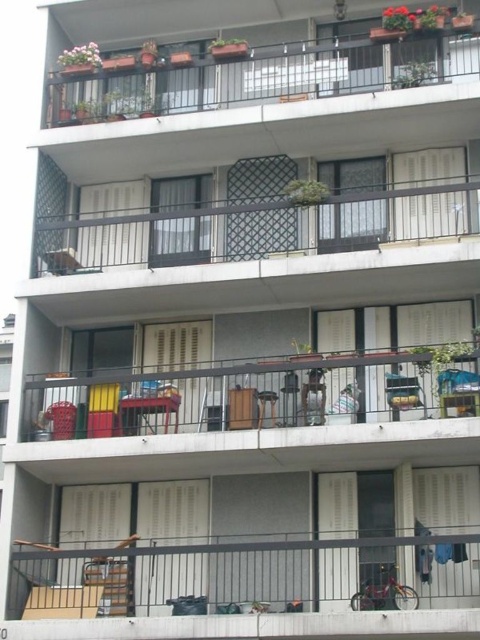
Is metallic gray railing at lower center positioned before metallic gray furniture at lower left?

Yes, metallic gray railing at lower center is in front of metallic gray furniture at lower left.

Consider the image. Which of these two, metallic gray railing at lower center or metallic gray furniture at lower left, stands shorter?

metallic gray railing at lower center is shorter.

Find the location of a particular element. This screenshot has height=640, width=480. metallic gray railing at lower center is located at coordinates (263, 568).

Where is `metallic gray railing at lower center`? metallic gray railing at lower center is located at coordinates (263, 568).

Which of these two, metallic gray railing at lower center or metallic silver chair at center, stands shorter?

With less height is metallic silver chair at center.

Can you confirm if metallic gray railing at lower center is smaller than metallic silver chair at center?

No.

Find the location of a particular element. Image resolution: width=480 pixels, height=640 pixels. metallic gray railing at lower center is located at coordinates (263, 568).

This screenshot has width=480, height=640. What are the coordinates of `metallic gray railing at lower center` in the screenshot? It's located at (263, 568).

The width and height of the screenshot is (480, 640). Describe the element at coordinates (228, 451) in the screenshot. I see `metallic gray furniture at lower left` at that location.

Between point (276, 442) and point (396, 381), which one is positioned in front?

Positioned in front is point (276, 442).

Is point (235, 369) closer to viewer compared to point (396, 376)?

No, it is not.

The width and height of the screenshot is (480, 640). What are the coordinates of `metallic gray furniture at lower left` in the screenshot? It's located at (228, 451).